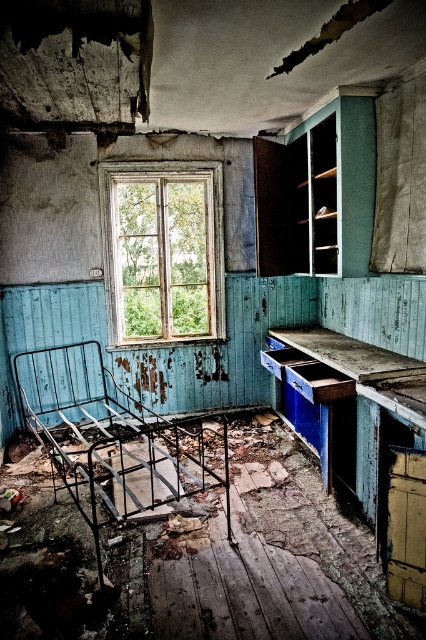
You are standing in the room and want to reach a specific point marked at coordinates point (45,444). If your maximum reach distance is 15 feet, can you reach that point without moving closer?

The distance of point (45,444) from camera is 14.43 feet, which is within your maximum reach distance of 15 feet. Therefore, you can reach the point without moving closer.

You are standing in the abandoned room and want to move from the wooden window at center to the rusty metal bed at lower left. Which direction should you move to reach the bed?

To reach the rusty metal bed at lower left from the wooden window at center, you should move to the right since the rusty metal bed at lower left is located to the right of the wooden window at center.